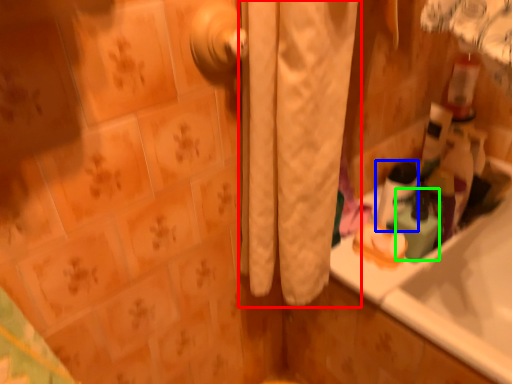
Question: Estimate the real-world distances between objects in this image. Which object is farther from curtain (highlighted by a red box), mouthwash (highlighted by a blue box) or cleaning product (highlighted by a green box)?

Choices:
 (A) mouthwash
 (B) cleaning product

Answer: (B)